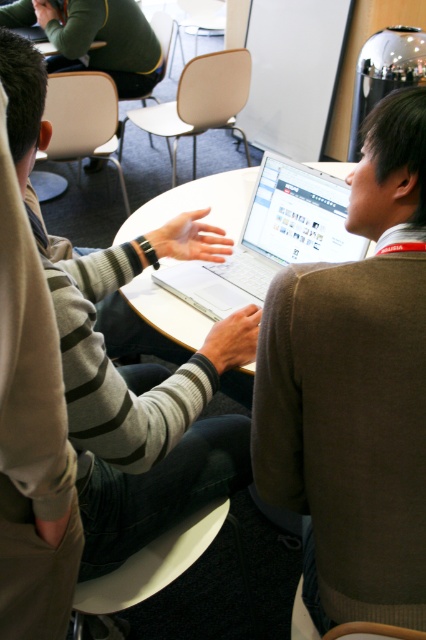
Question: Which of these objects is positioned closest to the brown wool sweater at upper right?

Choices:
 (A) metallic silver chair at upper center
 (B) white plastic chair at upper center

Answer: (B)

Question: Can you confirm if silver metallic laptop at center is smaller than beige plastic chair at upper center?

Choices:
 (A) no
 (B) yes

Answer: (B)

Question: Which point appears farthest from the camera in this image?

Choices:
 (A) (201, 97)
 (B) (414, 248)
 (C) (155, 26)

Answer: (C)

Question: Which object is the farthest from the metallic silver chair at upper center?

Choices:
 (A) beige plastic chair at upper center
 (B) white plastic chair at lower center
 (C) white plastic chair at upper center
 (D) brown wool sweater at upper right

Answer: (B)

Question: Does white plastic chair at upper left lie in front of metallic silver chair at upper center?

Choices:
 (A) yes
 (B) no

Answer: (A)

Question: Does white plastic chair at upper left have a smaller size compared to metallic silver chair at upper center?

Choices:
 (A) yes
 (B) no

Answer: (A)